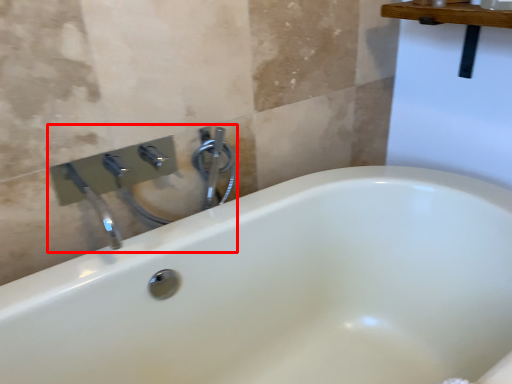
Question: Observing the image, what is the correct spatial positioning of sink (annotated by the red box) in reference to plumbing fixture?

Choices:
 (A) right
 (B) left

Answer: (B)